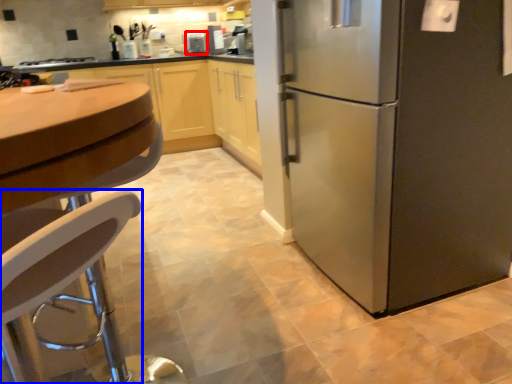
Question: Which object appears farthest to the camera in this image, appliance (highlighted by a red box) or chair (highlighted by a blue box)?

Choices:
 (A) appliance
 (B) chair

Answer: (A)